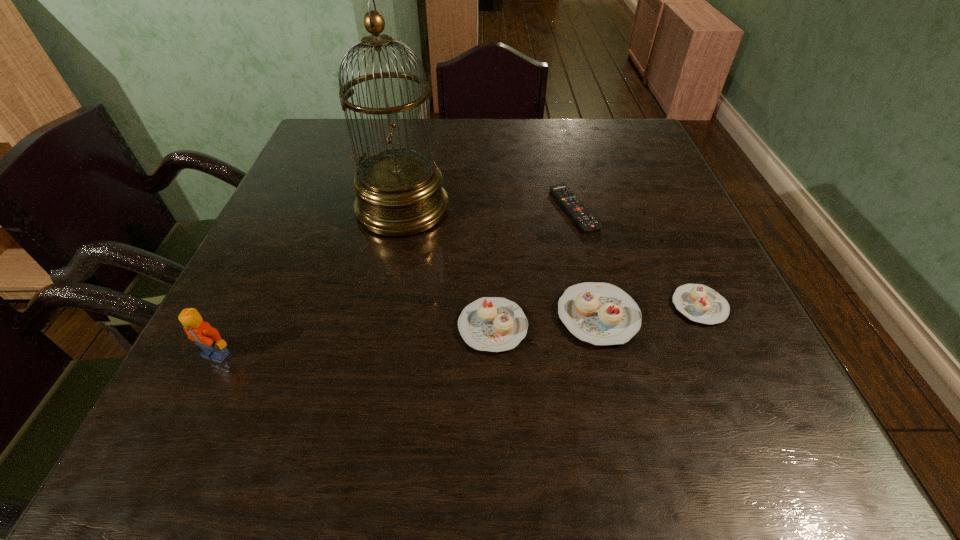
Locate an element on the screen. free space between the tallest cupcake and the second shortest object is located at coordinates (649, 311).

Where is `free point between the fifth shortest object and the rightmost cupcake`? This screenshot has width=960, height=540. free point between the fifth shortest object and the rightmost cupcake is located at coordinates (458, 330).

Where is `free spot between the fourth shortest object and the fifth shortest object`? free spot between the fourth shortest object and the fifth shortest object is located at coordinates (407, 335).

The image size is (960, 540). In order to click on empty location between the rightmost object and the shortest object in this screenshot , I will do `click(636, 258)`.

This screenshot has height=540, width=960. In order to click on unoccupied area between the leftmost cupcake and the tallest object in this screenshot , I will do `click(447, 268)`.

You are a GUI agent. You are given a task and a screenshot of the screen. Output one action in this format:
    pyautogui.click(x=<x>, y=<y>)
    Task: Click on the vacant space that's between the fourth shortest object and the shortest object
    This screenshot has width=960, height=540.
    Given the screenshot: What is the action you would take?
    pyautogui.click(x=586, y=263)

At what (x,y) coordinates should I click in order to perform the action: click on free space between the birdcage and the remote control. Please return your answer as a coordinate pair (x, y). Image resolution: width=960 pixels, height=540 pixels. Looking at the image, I should click on (488, 209).

Select which object appears as the second closest to the fifth object from right to left. Please provide its 2D coordinates. Your answer should be formatted as a tuple, i.e. [(x, y)], where the tuple contains the x and y coordinates of a point satisfying the conditions above.

[(582, 216)]

Locate which object is the closest to the fifth tallest object. Please provide its 2D coordinates. Your answer should be formatted as a tuple, i.e. [(x, y)], where the tuple contains the x and y coordinates of a point satisfying the conditions above.

[(600, 313)]

Locate an element on the screen. This screenshot has width=960, height=540. the second closest cupcake to the leftmost cupcake is located at coordinates (699, 303).